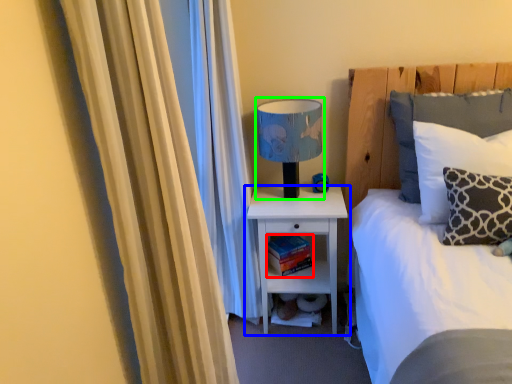
Question: Estimate the real-world distances between objects in this image. Which object is closer to book (highlighted by a red box), nightstand (highlighted by a blue box) or table lamp (highlighted by a green box)?

Choices:
 (A) nightstand
 (B) table lamp

Answer: (A)